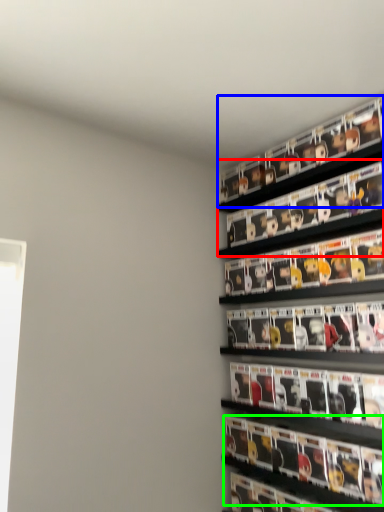
Question: Based on their relative distances, which object is farther from shelf (highlighted by a red box)? Choose from shelf (highlighted by a blue box) and magazine (highlighted by a green box).

Choices:
 (A) shelf
 (B) magazine

Answer: (B)